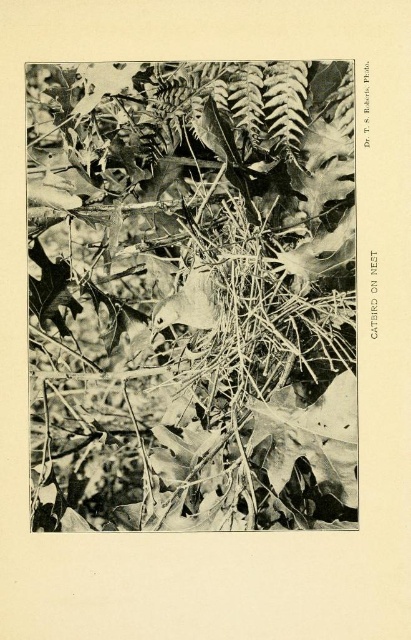
Question: Among these objects, which one is nearest to the camera?

Choices:
 (A) smooth gray bird at center
 (B) brown textured nest at center

Answer: (B)

Question: Where is brown textured nest at center located in relation to smooth gray bird at center in the image?

Choices:
 (A) above
 (B) below

Answer: (A)

Question: Which point is farther to the camera?

Choices:
 (A) (307, 330)
 (B) (175, 316)

Answer: (B)

Question: Observing the image, what is the correct spatial positioning of brown textured nest at center in reference to smooth gray bird at center?

Choices:
 (A) below
 (B) above

Answer: (B)

Question: Is brown textured nest at center to the left of smooth gray bird at center from the viewer's perspective?

Choices:
 (A) no
 (B) yes

Answer: (A)

Question: Among these points, which one is farthest from the camera?

Choices:
 (A) (210, 326)
 (B) (283, 496)

Answer: (A)